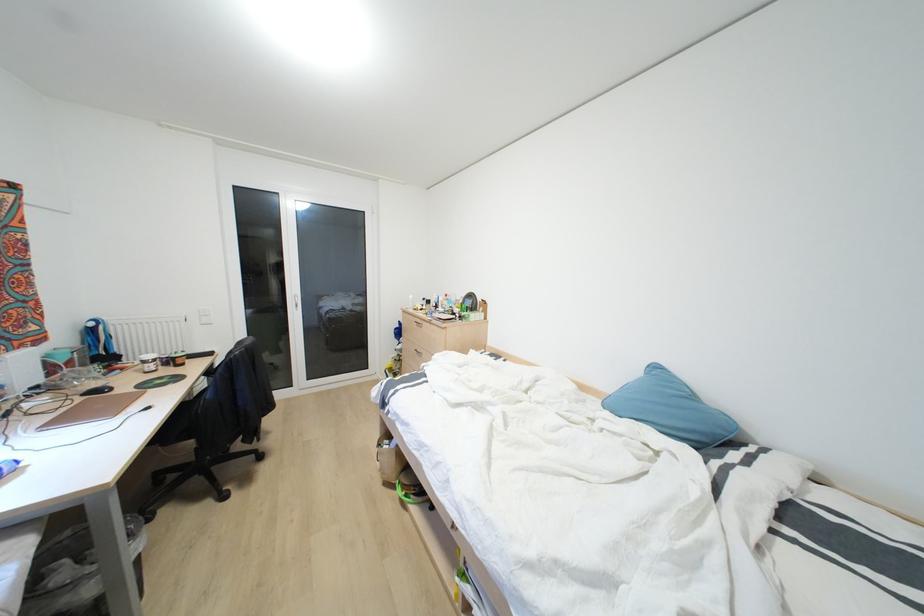
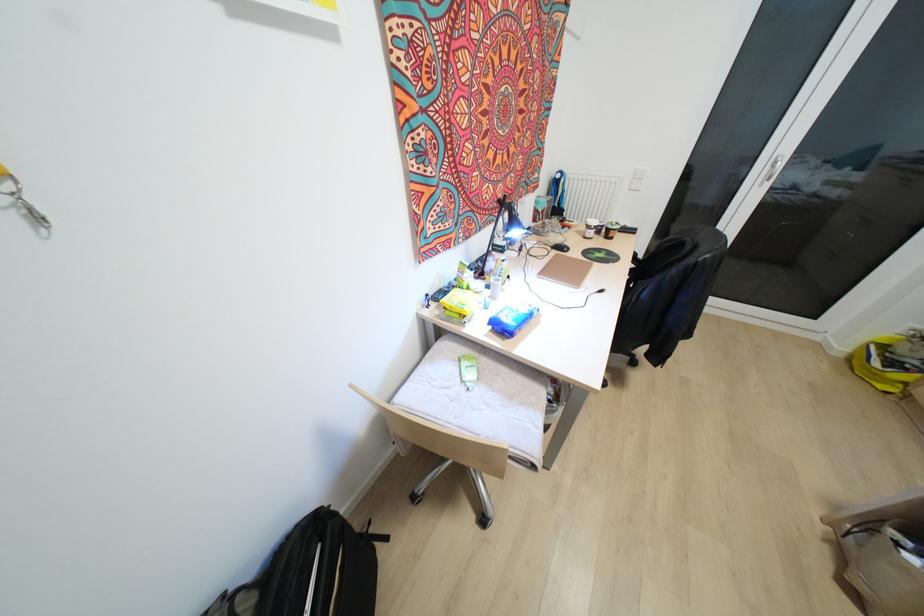
First-person continuous shooting, in which direction is the camera rotating?

The rotation direction of the camera is left-down.